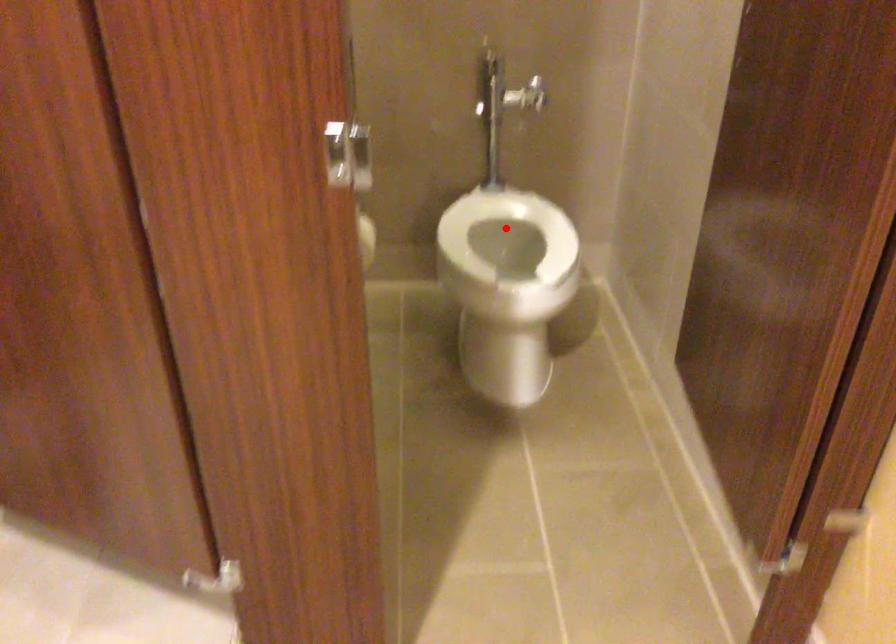
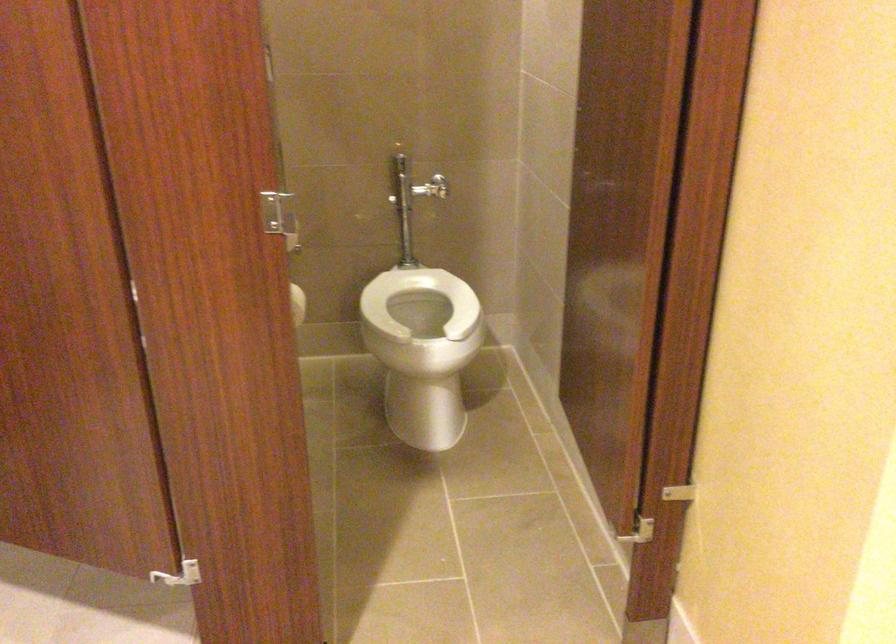
In the second image, find the point that corresponds to the highlighted location in the first image.

(419, 301)